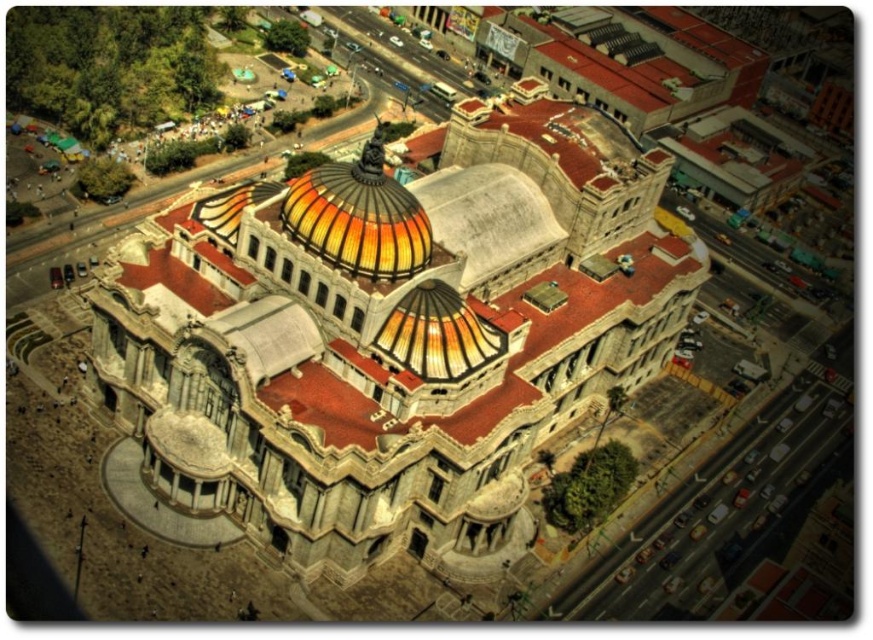
Does matte stone church at center come behind translucent glass dome at center?

No, it is in front of translucent glass dome at center.

Is point (493, 205) positioned behind point (416, 252)?

Yes, point (493, 205) is behind point (416, 252).

The height and width of the screenshot is (640, 873). What are the coordinates of `matte stone church at center` in the screenshot? It's located at (394, 332).